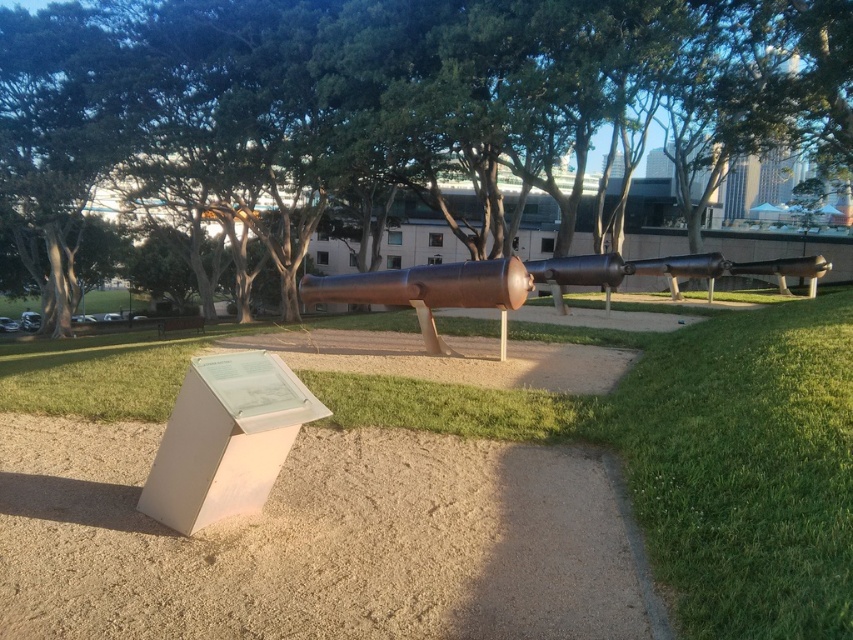
You are standing at the edge of the park where the cannons are displayed. You want to walk directly to the informational plaque in front of the cannons. Which direction should you walk relative to the green grass at center?

The green grass at center is located at point [695,456]. Since the informational plaque is in front of the cannons, which are positioned side by side on the sand or gravel, you should walk towards the cannons away from the green grass at center.

You are a park visitor standing in front of the cannons. You want to place a small flag on the green grass at center. Is the bronze cannon at center blocking your view of the flag from where you are standing?

The green grass at center is below bronze cannon at center, so the bronze cannon at center would block your view of the flag placed on the green grass at center.